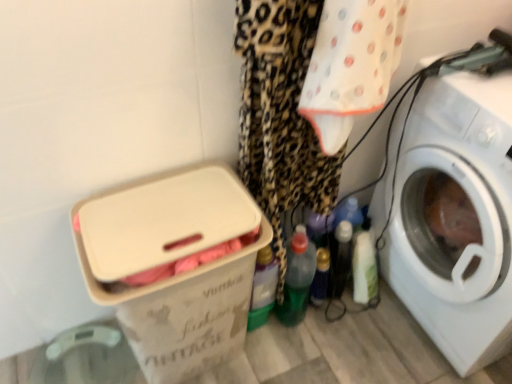
At what (x,y) coordinates should I click in order to perform the action: click on white plastic box at lower left. Please return your answer as a coordinate pair (x, y). Looking at the image, I should click on (173, 263).

What do you see at coordinates (297, 279) in the screenshot? I see `green plastic bottle at center, which is counted as the second bottle, starting from the right` at bounding box center [297, 279].

Locate an element on the screen. The height and width of the screenshot is (384, 512). white plastic box at lower left is located at coordinates (173, 263).

Would you consider green plastic bottle at center, which is counted as the second bottle, starting from the right, to be distant from white plastic box at lower left?

No.

Is green plastic bottle at center, which is counted as the second bottle, starting from the right, located outside white plastic box at lower left?

green plastic bottle at center, which is counted as the second bottle, starting from the right, is positioned outside white plastic box at lower left.

Relative to white plastic box at lower left, is green plastic bottle at center, arranged as the 2th bottle when viewed from the left, in front or behind?

In the image, green plastic bottle at center, arranged as the 2th bottle when viewed from the left, appears behind white plastic box at lower left.

From a real-world perspective, is green plastic bottle at center, which is counted as the second bottle, starting from the right, over translucent plastic bottle at center, which is the 1th bottle in right-to-left order?

Correct, in the physical world, green plastic bottle at center, which is counted as the second bottle, starting from the right, is higher than translucent plastic bottle at center, which is the 1th bottle in right-to-left order.

From the image's perspective, which is below, green plastic bottle at center, which is counted as the second bottle, starting from the right, or translucent plastic bottle at center, the third bottle viewed from the left?

translucent plastic bottle at center, the third bottle viewed from the left, from the image's perspective.

Can we say green plastic bottle at center, which is counted as the second bottle, starting from the right, lies outside translucent plastic bottle at center, the third bottle viewed from the left?

Yes, green plastic bottle at center, which is counted as the second bottle, starting from the right, is not within translucent plastic bottle at center, the third bottle viewed from the left.

Is green plastic bottle at center, which is counted as the second bottle, starting from the right, positioned with its back to translucent plastic bottle at center, the third bottle viewed from the left?

No.

From a real-world perspective, is green translucent bottle at center, arranged as the 3th bottle when viewed from the right, physically below white plastic box at lower left?

Yes, from a real-world perspective, green translucent bottle at center, arranged as the 3th bottle when viewed from the right, is under white plastic box at lower left.

Considering the relative sizes of green translucent bottle at center, arranged as the 3th bottle when viewed from the right, and white plastic box at lower left in the image provided, is green translucent bottle at center, arranged as the 3th bottle when viewed from the right, thinner than white plastic box at lower left?

Indeed, green translucent bottle at center, arranged as the 3th bottle when viewed from the right, has a lesser width compared to white plastic box at lower left.

Which object is positioned more to the right, green translucent bottle at center, which is the 1th bottle from left to right, or white plastic box at lower left?

From the viewer's perspective, green translucent bottle at center, which is the 1th bottle from left to right, appears more on the right side.

In terms of size, does green translucent bottle at center, arranged as the 3th bottle when viewed from the right, appear bigger or smaller than white plastic box at lower left?

Considering their sizes, green translucent bottle at center, arranged as the 3th bottle when viewed from the right, takes up less space than white plastic box at lower left.

Considering the relative positions of green translucent bottle at center, which is the 1th bottle from left to right, and translucent plastic bottle at center, the third bottle viewed from the left, in the image provided, is green translucent bottle at center, which is the 1th bottle from left to right, to the right of translucent plastic bottle at center, the third bottle viewed from the left, from the viewer's perspective?

Incorrect, green translucent bottle at center, which is the 1th bottle from left to right, is not on the right side of translucent plastic bottle at center, the third bottle viewed from the left.

Is point (277, 271) positioned in front of point (317, 271)?

That is True.

Is green translucent bottle at center, arranged as the 3th bottle when viewed from the right, far from translucent plastic bottle at center, which is the 1th bottle in right-to-left order?

No, green translucent bottle at center, arranged as the 3th bottle when viewed from the right, is not far from translucent plastic bottle at center, which is the 1th bottle in right-to-left order.

Is green translucent bottle at center, which is the 1th bottle from left to right, thinner than translucent plastic bottle at center, the third bottle viewed from the left?

No.

Considering the relative sizes of translucent plastic bottle at center, the third bottle viewed from the left, and white plastic washing machine at right in the image provided, is translucent plastic bottle at center, the third bottle viewed from the left, shorter than white plastic washing machine at right?

Indeed, translucent plastic bottle at center, the third bottle viewed from the left, has a lesser height compared to white plastic washing machine at right.

Based on their positions, is translucent plastic bottle at center, which is the 1th bottle in right-to-left order, located to the left or right of white plastic washing machine at right?

translucent plastic bottle at center, which is the 1th bottle in right-to-left order, is positioned on white plastic washing machine at right's left side.

Is point (324, 259) less distant than point (510, 288)?

That is False.

Is translucent plastic bottle at center, the third bottle viewed from the left, facing away from white plastic washing machine at right?

translucent plastic bottle at center, the third bottle viewed from the left, is not turned away from white plastic washing machine at right.

Does translucent plastic bottle at center, the third bottle viewed from the left, have a larger size compared to green plastic bottle at center, arranged as the 2th bottle when viewed from the left?

No, translucent plastic bottle at center, the third bottle viewed from the left, is not bigger than green plastic bottle at center, arranged as the 2th bottle when viewed from the left.

Based on the photo, from a real-world perspective, which is physically above, translucent plastic bottle at center, the third bottle viewed from the left, or green plastic bottle at center, which is counted as the second bottle, starting from the right?

green plastic bottle at center, which is counted as the second bottle, starting from the right.

Find the location of a particular element. Image resolution: width=512 pixels, height=384 pixels. bottle that is below the green plastic bottle at center, which is counted as the second bottle, starting from the right (from the image's perspective) is located at coordinates (320, 277).

Who is shorter, translucent plastic bottle at center, the third bottle viewed from the left, or green plastic bottle at center, which is counted as the second bottle, starting from the right?

translucent plastic bottle at center, the third bottle viewed from the left.

Which is more to the left, white plastic box at lower left or translucent plastic bottle at center, the third bottle viewed from the left?

From the viewer's perspective, white plastic box at lower left appears more on the left side.

Is point (170, 207) farther from camera compared to point (319, 273)?

No.

Looking at the image, does white plastic box at lower left seem bigger or smaller compared to translucent plastic bottle at center, the third bottle viewed from the left?

Clearly, white plastic box at lower left is larger in size than translucent plastic bottle at center, the third bottle viewed from the left.

Locate an element on the screen. Image resolution: width=512 pixels, height=384 pixels. box above the green plastic bottle at center, arranged as the 2th bottle when viewed from the left (from a real-world perspective) is located at coordinates (173, 263).

Image resolution: width=512 pixels, height=384 pixels. Identify the location of the 1st bottle above the translucent plastic bottle at center, the third bottle viewed from the left (from the image's perspective). (297, 279).

From the image, which object appears to be farther from white plastic box at lower left, white plastic washing machine at right or translucent plastic bottle at center, which is the 1th bottle in right-to-left order?

The object further to white plastic box at lower left is white plastic washing machine at right.

Which object lies nearer to the anchor point white plastic box at lower left, translucent plastic bottle at center, which is the 1th bottle in right-to-left order, or green translucent bottle at center, arranged as the 3th bottle when viewed from the right?

The object closer to white plastic box at lower left is green translucent bottle at center, arranged as the 3th bottle when viewed from the right.

Estimate the real-world distances between objects in this image. Which object is further from green translucent bottle at center, which is the 1th bottle from left to right, white plastic box at lower left or translucent plastic bottle at center, which is the 1th bottle in right-to-left order?

white plastic box at lower left lies further to green translucent bottle at center, which is the 1th bottle from left to right, than the other object.

Considering their positions, is green translucent bottle at center, arranged as the 3th bottle when viewed from the right, positioned closer to green plastic bottle at center, which is counted as the second bottle, starting from the right, than white plastic washing machine at right?

The object closer to green plastic bottle at center, which is counted as the second bottle, starting from the right, is green translucent bottle at center, arranged as the 3th bottle when viewed from the right.

When comparing their distances from green translucent bottle at center, arranged as the 3th bottle when viewed from the right, does green plastic bottle at center, arranged as the 2th bottle when viewed from the left, or translucent plastic bottle at center, the third bottle viewed from the left, seem closer?

The object closer to green translucent bottle at center, arranged as the 3th bottle when viewed from the right, is green plastic bottle at center, arranged as the 2th bottle when viewed from the left.

Which object lies further to the anchor point white plastic washing machine at right, white plastic box at lower left or green plastic bottle at center, arranged as the 2th bottle when viewed from the left?

white plastic box at lower left lies further to white plastic washing machine at right than the other object.

From the image, which object appears to be farther from white plastic box at lower left, green plastic bottle at center, which is counted as the second bottle, starting from the right, or green translucent bottle at center, arranged as the 3th bottle when viewed from the right?

The object further to white plastic box at lower left is green plastic bottle at center, which is counted as the second bottle, starting from the right.

In the scene shown: Estimate the real-world distances between objects in this image. Which object is further from white plastic box at lower left, green plastic bottle at center, arranged as the 2th bottle when viewed from the left, or translucent plastic bottle at center, the third bottle viewed from the left?

Based on the image, translucent plastic bottle at center, the third bottle viewed from the left, appears to be further to white plastic box at lower left.

In order to click on bottle between white plastic box at lower left and green plastic bottle at center, arranged as the 2th bottle when viewed from the left, in the front-back direction in this screenshot , I will do `click(263, 288)`.

Find the location of a particular element. bottle located between green translucent bottle at center, arranged as the 3th bottle when viewed from the right, and translucent plastic bottle at center, the third bottle viewed from the left, in the left-right direction is located at coordinates (297, 279).

This screenshot has width=512, height=384. Identify the location of bottle between green plastic bottle at center, arranged as the 2th bottle when viewed from the left, and white plastic washing machine at right. (320, 277).